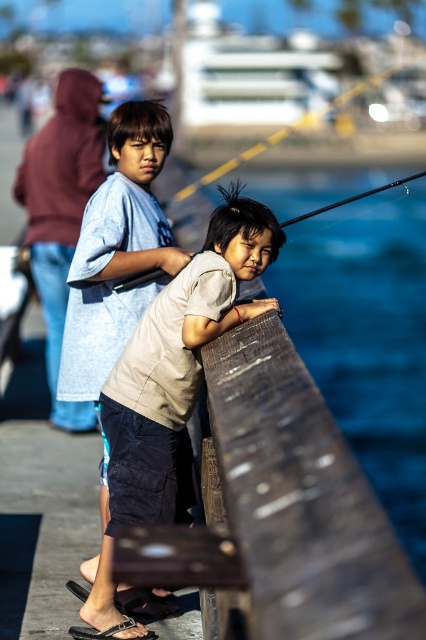
You are standing at the center of the dock and want to locate the light blue cotton shirt at center. According to the coordinates provided, in which direction should you look to find it?

The light blue cotton shirt at center is located at coordinates point (117, 250). Since the coordinate system is not specified, it is recommended to look towards the central area slightly to the right and lower side of the dock.

You are a photographer standing at the dock. You have two fishing poles in your view. The matte black fishing pole at upper center and the black glossy fishing pole at upper right. Which one is thinner?

The matte black fishing pole at upper center is thinner than the black glossy fishing pole at upper right.